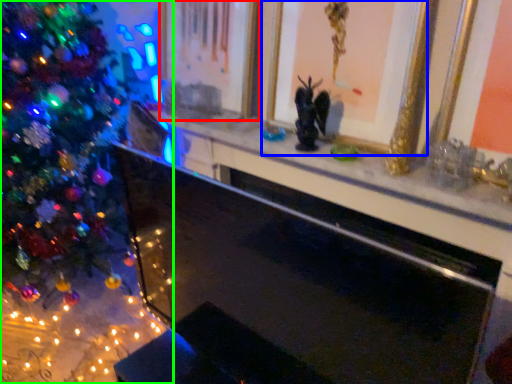
Question: Which object is positioned farthest from picture frame (highlighted by a red box)? Select from picture frame (highlighted by a blue box) and christmas tree (highlighted by a green box).

Choices:
 (A) picture frame
 (B) christmas tree

Answer: (B)